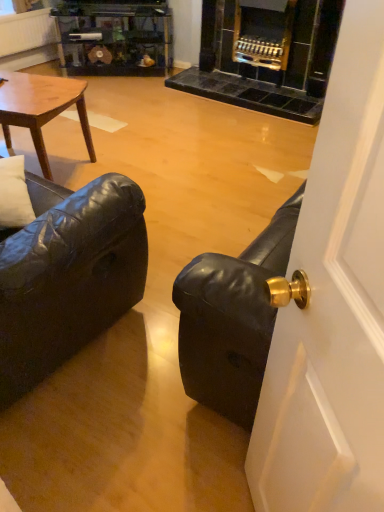
Question: Is black leather couch at right thinner than black leather couch at left?

Choices:
 (A) yes
 (B) no

Answer: (A)

Question: Does black leather couch at right have a smaller size compared to black leather couch at left?

Choices:
 (A) yes
 (B) no

Answer: (A)

Question: Does black leather couch at right come behind black leather couch at left?

Choices:
 (A) no
 (B) yes

Answer: (A)

Question: Is black leather couch at left at the back of black leather couch at right?

Choices:
 (A) no
 (B) yes

Answer: (A)

Question: Considering the relative sizes of black leather couch at right and black leather couch at left in the image provided, is black leather couch at right wider than black leather couch at left?

Choices:
 (A) yes
 (B) no

Answer: (B)

Question: Is the surface of black leather couch at right in direct contact with black leather couch at left?

Choices:
 (A) yes
 (B) no

Answer: (B)

Question: Considering the relative positions of wooden glossy coffee table at upper left and black leather couch at right in the image provided, is wooden glossy coffee table at upper left to the right of black leather couch at right from the viewer's perspective?

Choices:
 (A) yes
 (B) no

Answer: (B)

Question: Is the position of wooden glossy coffee table at upper left less distant than that of black leather couch at right?

Choices:
 (A) no
 (B) yes

Answer: (A)

Question: Is wooden glossy coffee table at upper left smaller than black leather couch at right?

Choices:
 (A) yes
 (B) no

Answer: (A)

Question: From the image's perspective, is wooden glossy coffee table at upper left located above black leather couch at right?

Choices:
 (A) no
 (B) yes

Answer: (B)

Question: Is wooden glossy coffee table at upper left aimed at black leather couch at right?

Choices:
 (A) yes
 (B) no

Answer: (B)

Question: Is wooden glossy coffee table at upper left to the left of black leather couch at right from the viewer's perspective?

Choices:
 (A) no
 (B) yes

Answer: (B)

Question: Considering the relative sizes of wooden glossy coffee table at upper left and black leather couch at left in the image provided, is wooden glossy coffee table at upper left wider than black leather couch at left?

Choices:
 (A) yes
 (B) no

Answer: (B)